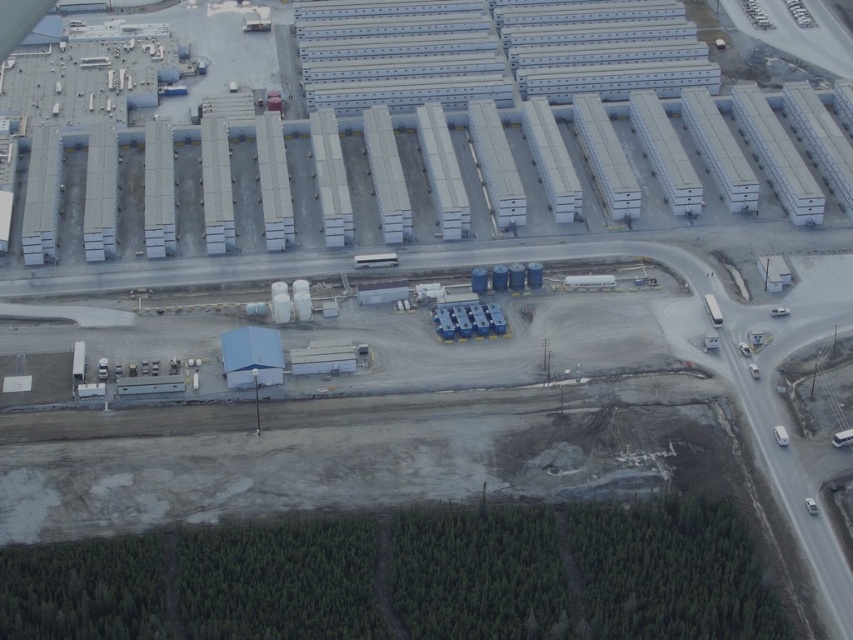
Does white corrugated metal warehouse at upper center have a smaller size compared to white corrugated metal containers at upper center?

No, white corrugated metal warehouse at upper center is not smaller than white corrugated metal containers at upper center.

Looking at this image, is white corrugated metal warehouse at upper center below white corrugated metal containers at upper center?

Yes.

Based on the photo, who is more distant from viewer, [407,173] or [416,17]?

Positioned behind is point [416,17].

This screenshot has height=640, width=853. I want to click on white corrugated metal warehouse at upper center, so click(431, 173).